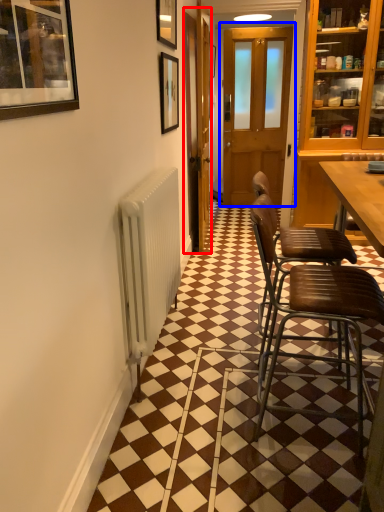
Question: Which point is further to the camera, screen door (highlighted by a red box) or door (highlighted by a blue box)?

Choices:
 (A) screen door
 (B) door

Answer: (B)